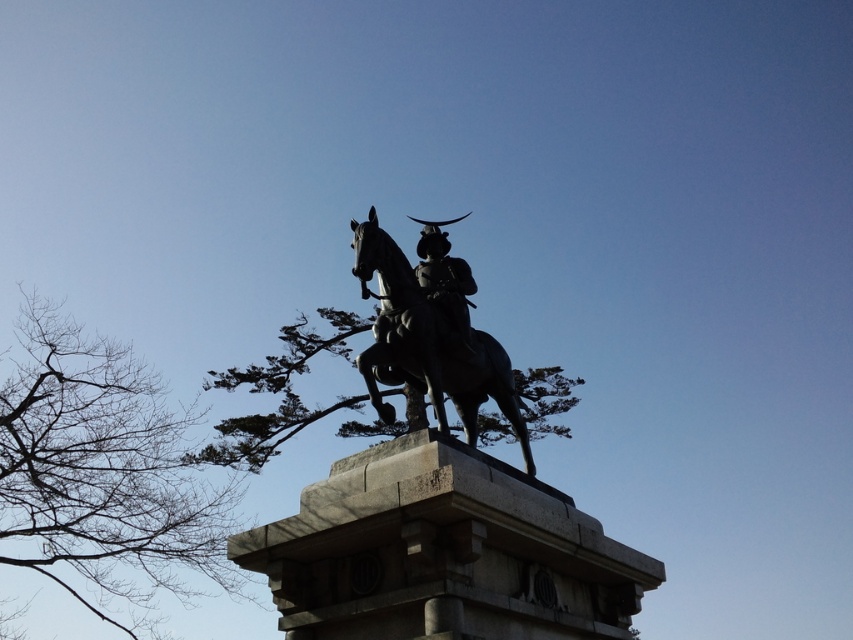
Question: Can you confirm if bare branches at left is positioned to the right of green textured tree at center?

Choices:
 (A) no
 (B) yes

Answer: (A)

Question: Which of these objects is positioned closest to the bronze horse at center?

Choices:
 (A) bronze statue at center
 (B) green textured tree at center

Answer: (A)

Question: Can you confirm if bare branches at left is thinner than shiny bronze helmet at center?

Choices:
 (A) yes
 (B) no

Answer: (B)

Question: Does bare branches at left appear on the right side of green textured tree at center?

Choices:
 (A) yes
 (B) no

Answer: (B)

Question: Which point appears farthest from the camera in this image?

Choices:
 (A) (502, 481)
 (B) (355, 272)
 (C) (22, 353)
 (D) (338, 406)

Answer: (C)

Question: Which object appears closest to the camera in this image?

Choices:
 (A) bronze horse at center
 (B) bronze statue at center
 (C) bare branches at left
 (D) shiny bronze helmet at center

Answer: (B)